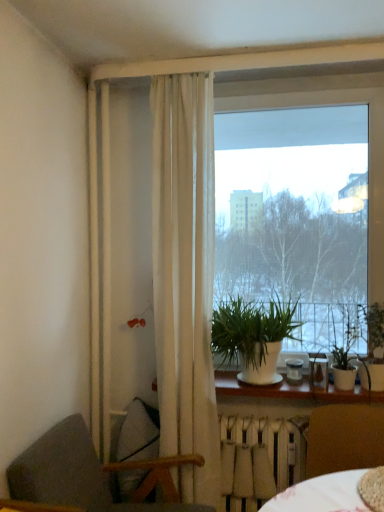
Where is `brown leather chair at lower right, which ranks as the second chair in left-to-right order`? brown leather chair at lower right, which ranks as the second chair in left-to-right order is located at coordinates (344, 438).

How much space does brown leather chair at lower right, which ranks as the second chair in left-to-right order, occupy horizontally?

The width of brown leather chair at lower right, which ranks as the second chair in left-to-right order, is 20.76 inches.

What do you see at coordinates (374, 346) in the screenshot? I see `green matte plant at right, the 1th houseplant in the right-to-left sequence` at bounding box center [374, 346].

This screenshot has width=384, height=512. What are the coordinates of `white sheer curtain at center` in the screenshot? It's located at (185, 275).

Image resolution: width=384 pixels, height=512 pixels. In order to click on brown leather chair at lower right, placed as the first chair when sorted from right to left in this screenshot , I will do `click(344, 438)`.

Based on the photo, is green matte plant at right, the 1th houseplant in the right-to-left sequence, not inside white sheer curtain at center?

Yes.

Can you tell me how much green matte plant at right, the 1th houseplant in the right-to-left sequence, and white sheer curtain at center differ in facing direction?

The angle between the facing direction of green matte plant at right, the 1th houseplant in the right-to-left sequence, and the facing direction of white sheer curtain at center is 0.317 degrees.

From a real-world perspective, relative to white sheer curtain at center, is green matte plant at right, the third houseplant from the left, vertically above or below?

Clearly, from a real-world perspective, green matte plant at right, the third houseplant from the left, is below white sheer curtain at center.

From the image's perspective, is green matte plant at right, the 1th houseplant in the right-to-left sequence, located above or below white sheer curtain at center?

Based on their image positions, green matte plant at right, the 1th houseplant in the right-to-left sequence, is located beneath white sheer curtain at center.

From the image's perspective, which object appears higher, brown leather chair at lower right, which ranks as the second chair in left-to-right order, or green matte plant at right, the third houseplant from the left?

green matte plant at right, the third houseplant from the left.

From a real-world perspective, who is located higher, brown leather chair at lower right, which ranks as the second chair in left-to-right order, or green matte plant at right, the third houseplant from the left?

green matte plant at right, the third houseplant from the left, from a real-world perspective.

Which object is further away from the camera, brown leather chair at lower right, which ranks as the second chair in left-to-right order, or green matte plant at right, the third houseplant from the left?

green matte plant at right, the third houseplant from the left.

Is white sheer curtain at center wider or thinner than white matte plant at center, the 1th houseplant from the left?

Clearly, white sheer curtain at center has less width compared to white matte plant at center, the 1th houseplant from the left.

Is white sheer curtain at center not within white matte plant at center, the 1th houseplant from the left?

white sheer curtain at center lies outside white matte plant at center, the 1th houseplant from the left,'s area.

Looking at the image, does white sheer curtain at center seem bigger or smaller compared to white matte plant at center, the 3th houseplant positioned from the right?

Clearly, white sheer curtain at center is larger in size than white matte plant at center, the 3th houseplant positioned from the right.

Is point (199, 164) farther from camera compared to point (230, 335)?

No.

Which is behind, point (334, 431) or point (13, 492)?

The point (334, 431) is behind.

Is brown leather chair at lower right, placed as the first chair when sorted from right to left, turned away from dark gray fabric chair at lower left, the 1th chair from the left?

That's not correct — brown leather chair at lower right, placed as the first chair when sorted from right to left, is not looking away from dark gray fabric chair at lower left, the 1th chair from the left.

In terms of height, does brown leather chair at lower right, which ranks as the second chair in left-to-right order, look taller or shorter compared to dark gray fabric chair at lower left, the second chair from the right?

brown leather chair at lower right, which ranks as the second chair in left-to-right order, is shorter than dark gray fabric chair at lower left, the second chair from the right.

Does green matte plant at right, the second houseplant in the right-to-left sequence, have a smaller size compared to brown leather chair at lower right, which ranks as the second chair in left-to-right order?

Indeed, green matte plant at right, the second houseplant in the right-to-left sequence, has a smaller size compared to brown leather chair at lower right, which ranks as the second chair in left-to-right order.

Starting from the brown leather chair at lower right, placed as the first chair when sorted from right to left, which houseplant is the 1st one to the right? Please provide its 2D coordinates.

[(347, 350)]

Is green matte plant at right, acting as the second houseplant starting from the left, looking in the opposite direction of brown leather chair at lower right, which ranks as the second chair in left-to-right order?

No.

Looking at this image, how many degrees apart are the facing directions of green matte plant at right, the second houseplant in the right-to-left sequence, and brown leather chair at lower right, which ranks as the second chair in left-to-right order?

The angle between the facing direction of green matte plant at right, the second houseplant in the right-to-left sequence, and the facing direction of brown leather chair at lower right, which ranks as the second chair in left-to-right order, is 5.38 degrees.

Where is `window above the white wood window sill at lower center (from the image's perspective)`? The image size is (384, 512). window above the white wood window sill at lower center (from the image's perspective) is located at coordinates (302, 206).

From a real-world perspective, which is physically above, transparent glass window at center or white wood window sill at lower center?

transparent glass window at center.

Does transparent glass window at center appear on the right side of white wood window sill at lower center?

Yes, transparent glass window at center is to the right of white wood window sill at lower center.

Considering the relative sizes of transparent glass window at center and white wood window sill at lower center in the image provided, is transparent glass window at center taller than white wood window sill at lower center?

Yes.

From the picture: Would you say white matte radiator at lower center is part of white matte plant at center, the 1th houseplant from the left,'s contents?

No, white matte radiator at lower center is not inside white matte plant at center, the 1th houseplant from the left.

Which is farther from the camera, (271, 358) or (252, 456)?

The point (271, 358) is behind.

Is white matte plant at center, the 1th houseplant from the left, wider or thinner than white matte radiator at lower center?

white matte plant at center, the 1th houseplant from the left, is wider than white matte radiator at lower center.

Which houseplant is the 2nd one when counting from the back of the white sheer curtain at center? Please provide its 2D coordinates.

[(374, 346)]

Find the location of `the 2nd houseplant to the right of the brown leather chair at lower right, placed as the first chair when sorted from right to left, counting from the anchor's position`. the 2nd houseplant to the right of the brown leather chair at lower right, placed as the first chair when sorted from right to left, counting from the anchor's position is located at coordinates (374, 346).

When comparing their distances from brown leather chair at lower right, placed as the first chair when sorted from right to left, does white sheer curtain at center or white matte plant at center, the 3th houseplant positioned from the right, seem closer?

Based on the image, white matte plant at center, the 3th houseplant positioned from the right, appears to be nearer to brown leather chair at lower right, placed as the first chair when sorted from right to left.

When comparing their distances from white matte radiator at lower center, does green matte plant at right, the third houseplant from the left, or white wood window sill at lower center seem further?

green matte plant at right, the third houseplant from the left.

Which object lies further to the anchor point brown leather chair at lower right, which ranks as the second chair in left-to-right order, white matte plant at center, the 3th houseplant positioned from the right, or green matte plant at right, the second houseplant in the right-to-left sequence?

Among the two, white matte plant at center, the 3th houseplant positioned from the right, is located further to brown leather chair at lower right, which ranks as the second chair in left-to-right order.

Looking at the image, which one is located further to dark gray fabric chair at lower left, the second chair from the right, white matte radiator at lower center or white matte plant at center, the 3th houseplant positioned from the right?

white matte plant at center, the 3th houseplant positioned from the right, lies further to dark gray fabric chair at lower left, the second chair from the right, than the other object.

Considering their positions, is white matte radiator at lower center positioned closer to brown leather chair at lower right, placed as the first chair when sorted from right to left, than green matte plant at right, the 1th houseplant in the right-to-left sequence?

white matte radiator at lower center lies closer to brown leather chair at lower right, placed as the first chair when sorted from right to left, than the other object.

Which object lies nearer to the anchor point white matte radiator at lower center, white wood window sill at lower center or transparent glass window at center?

white wood window sill at lower center lies closer to white matte radiator at lower center than the other object.

When comparing their distances from white sheer curtain at center, does white wood window sill at lower center or white matte radiator at lower center seem closer?

white matte radiator at lower center lies closer to white sheer curtain at center than the other object.

Based on their spatial positions, is green matte plant at right, acting as the second houseplant starting from the left, or green matte plant at right, the third houseplant from the left, further from white matte radiator at lower center?

Based on the image, green matte plant at right, the third houseplant from the left, appears to be further to white matte radiator at lower center.

At what (x,y) coordinates should I click in order to perform the action: click on window located between dark gray fabric chair at lower left, the second chair from the right, and green matte plant at right, acting as the second houseplant starting from the left, in the left-right direction. Please return your answer as a coordinate pair (x, y). The height and width of the screenshot is (512, 384). Looking at the image, I should click on 302,206.

Identify the location of chair situated between dark gray fabric chair at lower left, the second chair from the right, and green matte plant at right, the third houseplant from the left, from left to right. (344, 438).

Where is `window sill between white sheer curtain at center and white matte radiator at lower center in the vertical direction`? This screenshot has height=512, width=384. window sill between white sheer curtain at center and white matte radiator at lower center in the vertical direction is located at coordinates [x=293, y=390].

The width and height of the screenshot is (384, 512). In order to click on window sill between dark gray fabric chair at lower left, the second chair from the right, and green matte plant at right, the 1th houseplant in the right-to-left sequence, in the horizontal direction in this screenshot , I will do `click(293, 390)`.